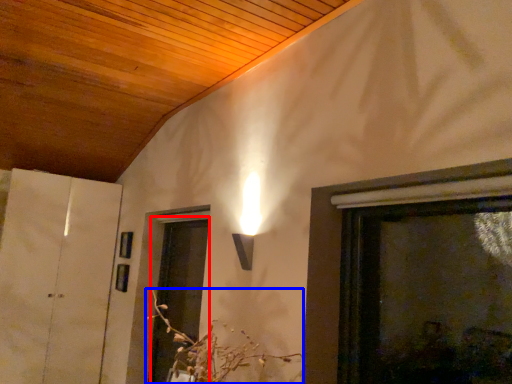
Question: Which point is further to the camera, screen door (highlighted by a red box) or flower (highlighted by a blue box)?

Choices:
 (A) screen door
 (B) flower

Answer: (A)